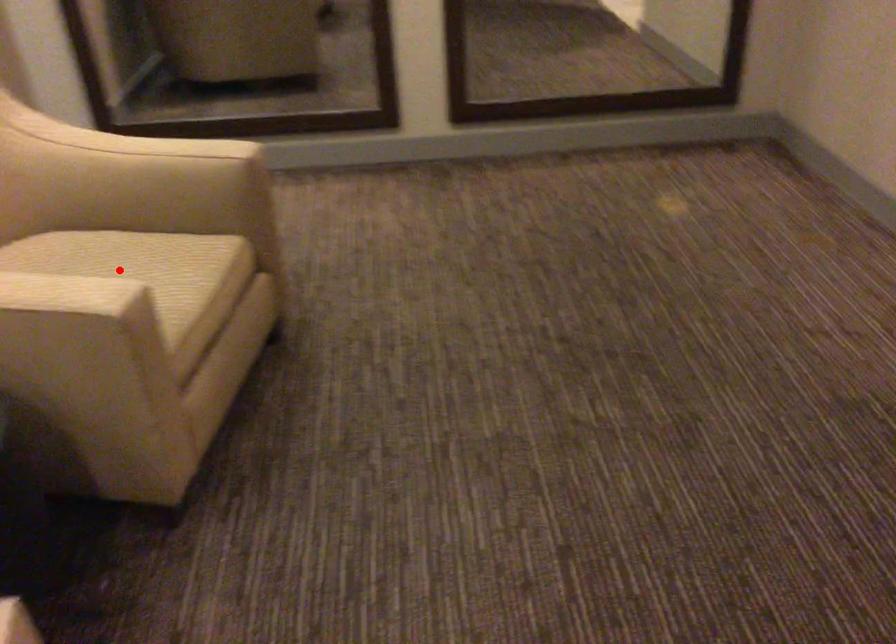
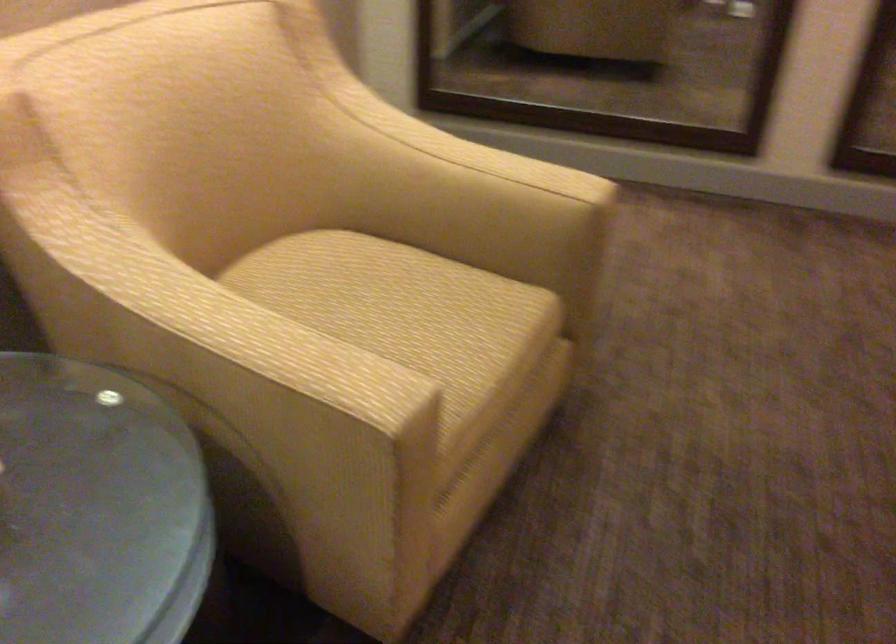
Where in the second image is the point corresponding to the highlighted location from the first image?

(403, 310)